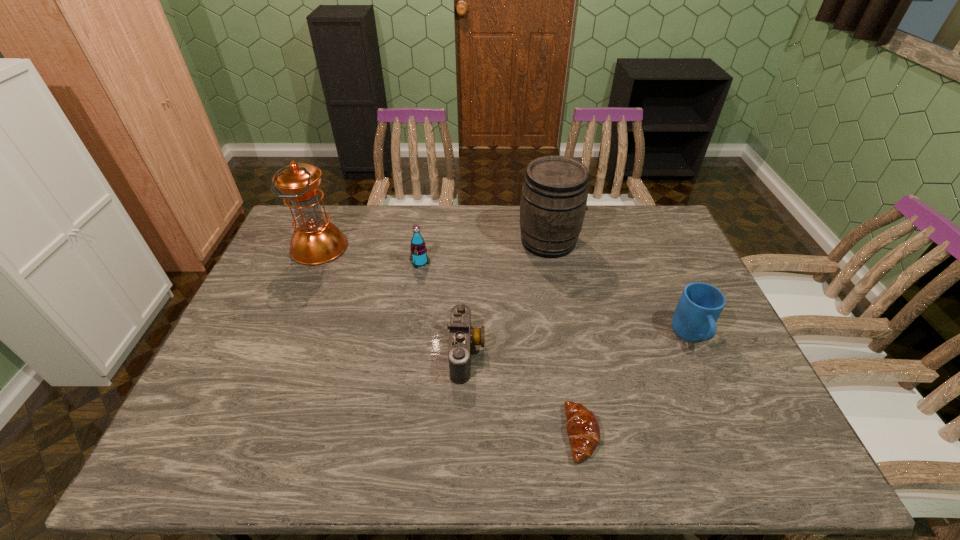
The height and width of the screenshot is (540, 960). I want to click on free location that satisfies the following two spatial constraints: 1. on the lens of the fifth tallest object; 2. on the back side of the shortest object, so click(465, 434).

I want to click on vacant region that satisfies the following two spatial constraints: 1. on the back side of the fifth object from right to left; 2. on the right side of the second tallest object, so click(423, 241).